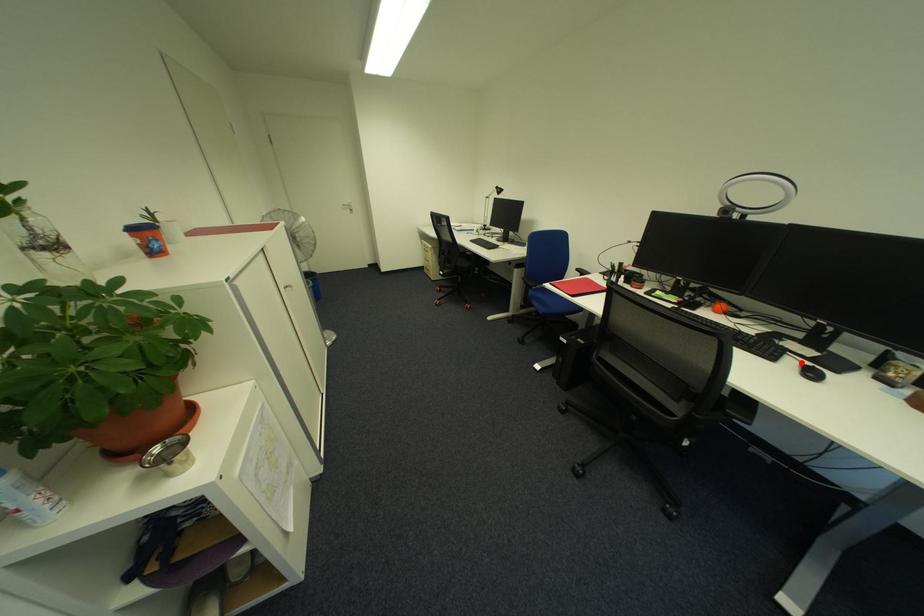
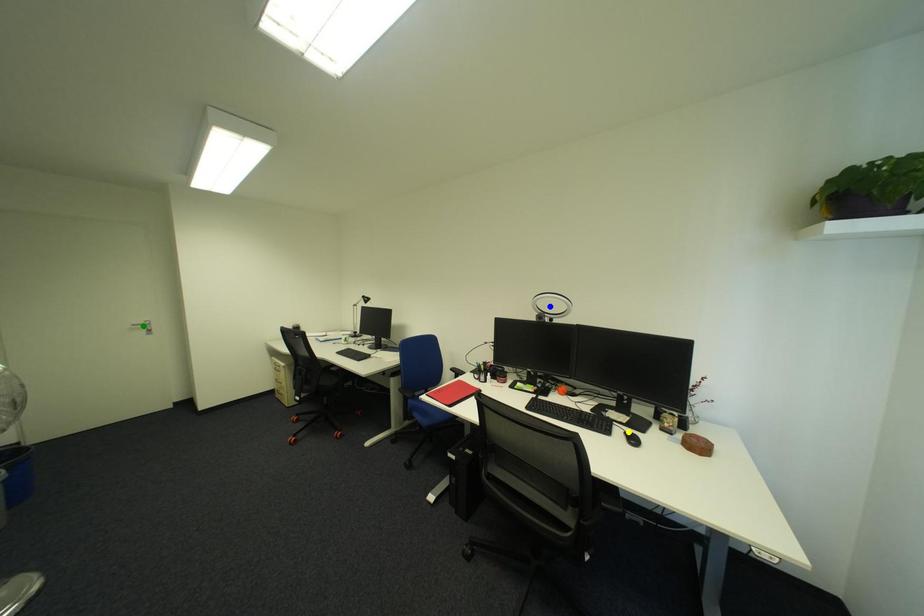
Question: I am providing you with two images of the same scene from different viewpoints. A red point is marked on the first image. You are given multiple points on the second image. Which point in image 2 is actually the same real-world point as the red point in image 1?

Choices:
 (A) green point
 (B) yellow point
 (C) blue point

Answer: (B)